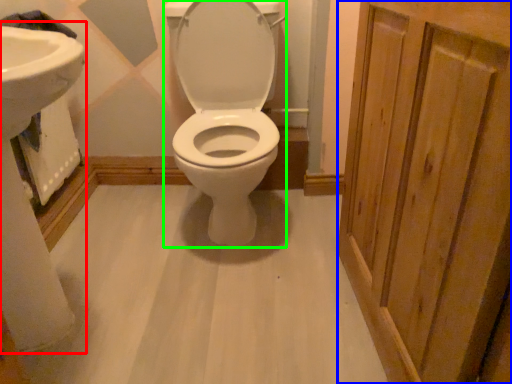
Question: Which object is positioned closest to sink (highlighted by a red box)? Select from screen door (highlighted by a blue box) and toilet (highlighted by a green box).

Choices:
 (A) screen door
 (B) toilet

Answer: (B)